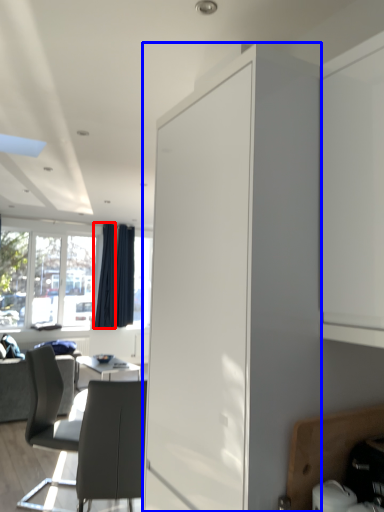
Question: Which of the following is the closest to the observer, curtain (highlighted by a red box) or cabinetry (highlighted by a blue box)?

Choices:
 (A) curtain
 (B) cabinetry

Answer: (B)